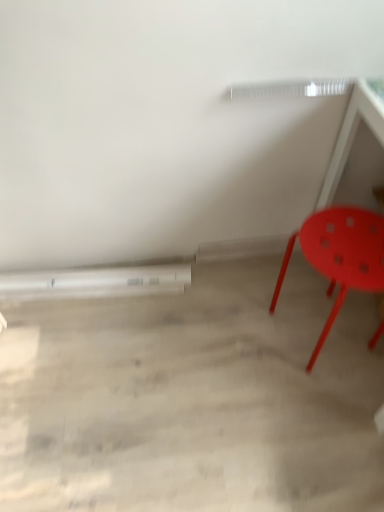
Question: Should I look upward or downward to see matte plastic chair at right?

Choices:
 (A) down
 (B) up

Answer: (A)